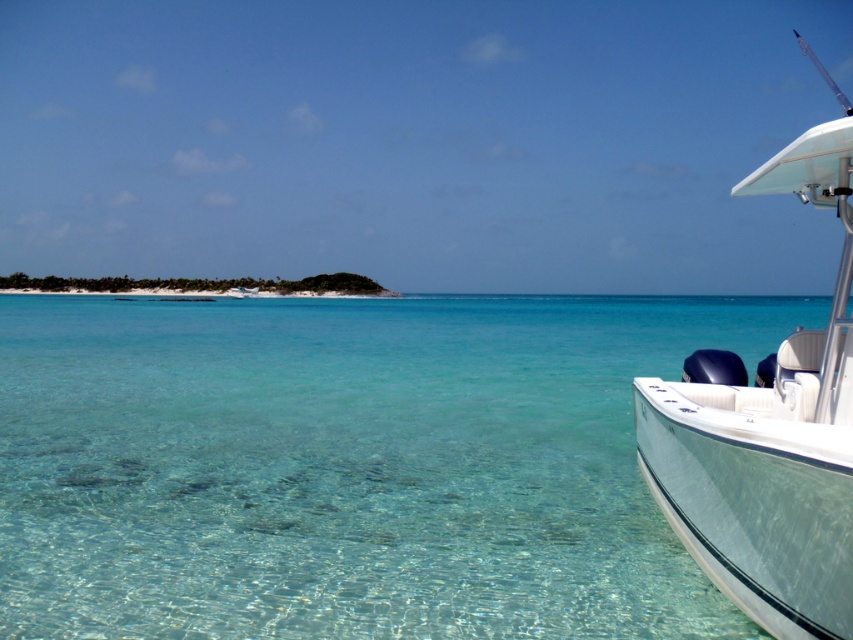
You are standing on the boat and looking towards the island. Which point, point (592,461) or point (759,186), is closer to you?

Point (592,461) is closer to you because it is further to the viewer than point (759,186).

You are standing on the beach and see the clear glassy water at lower right and the white glossy boat at right. Which object is closer to the shore?

The clear glassy water at lower right is positioned under the white glossy boat at right, meaning it is closer to the shore than the boat.